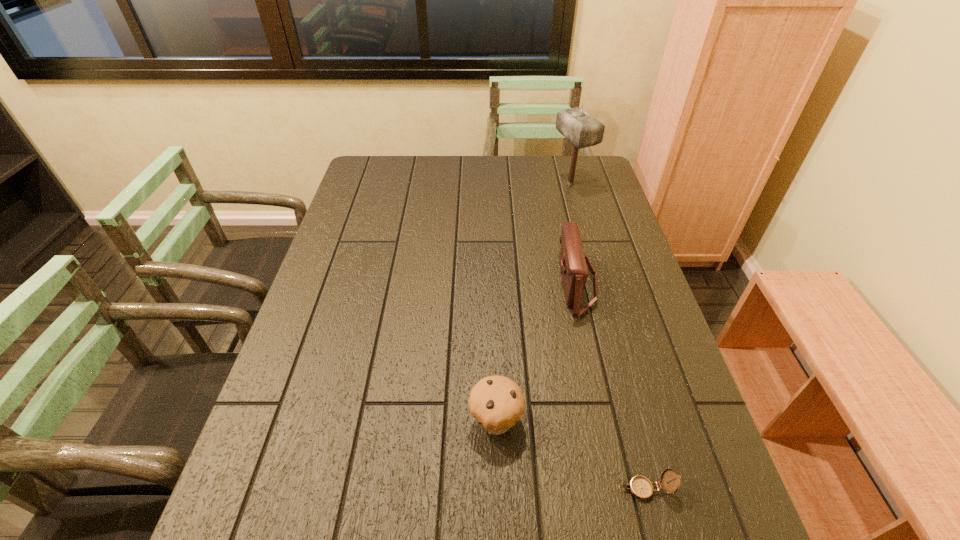
Identify the location of empty space that is in between the third nearest object and the muffin. (536, 352).

This screenshot has width=960, height=540. What are the coordinates of `free space between the second nearest object and the farthest object` in the screenshot? It's located at (533, 302).

Where is `vacant space in between the shortest object and the farthest object`? The image size is (960, 540). vacant space in between the shortest object and the farthest object is located at coordinates (608, 336).

Identify which object is the second nearest to the tallest object. Please provide its 2D coordinates. Your answer should be formatted as a tuple, i.e. [(x, y)], where the tuple contains the x and y coordinates of a point satisfying the conditions above.

[(496, 402)]

Choose which object is the third nearest neighbor to the nearest object. Please provide its 2D coordinates. Your answer should be formatted as a tuple, i.e. [(x, y)], where the tuple contains the x and y coordinates of a point satisfying the conditions above.

[(583, 130)]

You are a GUI agent. You are given a task and a screenshot of the screen. Output one action in this format:
    pyautogui.click(x=<x>, y=<y>)
    Task: Click on the vacant area in the image that satisfies the following two spatial constraints: 1. on the front side of the farthest object; 2. on the face of the nearest object
    The image size is (960, 540).
    Given the screenshot: What is the action you would take?
    pyautogui.click(x=653, y=489)